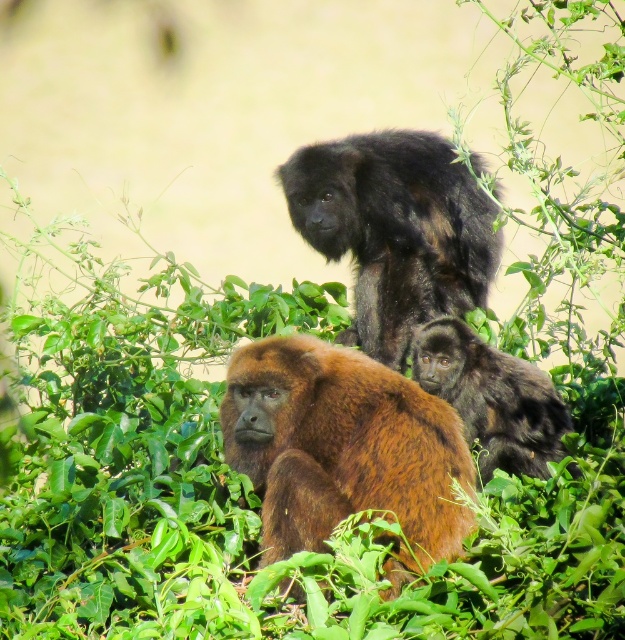
Question: Which of the following is the closest to the observer?

Choices:
 (A) shiny black monkey at upper center
 (B) shiny black monkey at center
 (C) brown furry monkey at center

Answer: (C)

Question: Is brown furry monkey at center further to camera compared to shiny black monkey at upper center?

Choices:
 (A) yes
 (B) no

Answer: (B)

Question: Can you confirm if shiny black monkey at upper center is positioned below shiny black monkey at center?

Choices:
 (A) yes
 (B) no

Answer: (B)

Question: Among these points, which one is nearest to the camera?

Choices:
 (A) (465, 312)
 (B) (575, 474)
 (C) (228, 451)

Answer: (C)

Question: Which object is the farthest from the shiny black monkey at center?

Choices:
 (A) brown furry monkey at center
 (B) shiny black monkey at upper center

Answer: (A)

Question: Considering the relative positions of shiny black monkey at upper center and shiny black monkey at center in the image provided, where is shiny black monkey at upper center located with respect to shiny black monkey at center?

Choices:
 (A) above
 (B) below

Answer: (A)